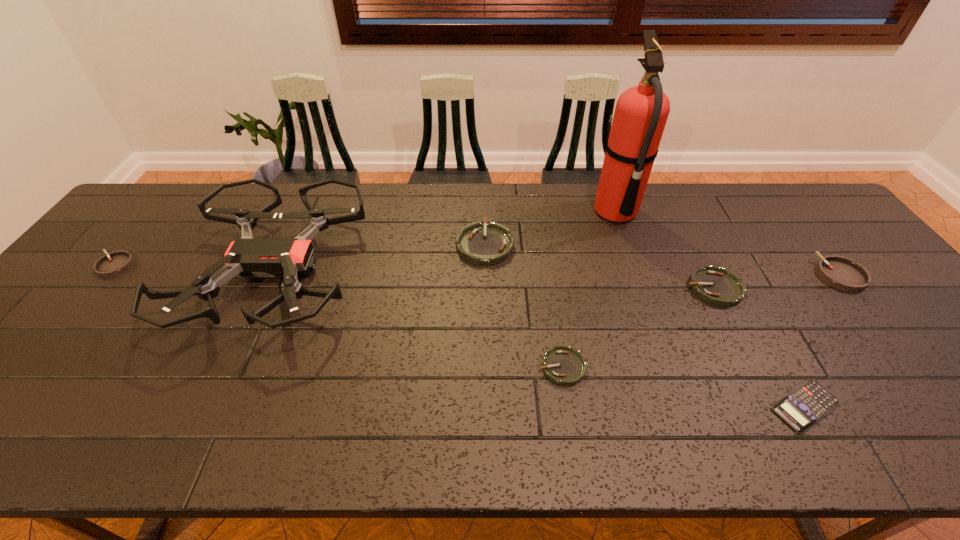
This screenshot has height=540, width=960. I want to click on the tallest object, so click(641, 113).

Locate an element on the screen. Image resolution: width=960 pixels, height=540 pixels. red fire extinguisher is located at coordinates (641, 113).

Find the location of a particular element. drone is located at coordinates (247, 257).

Where is `the seventh shortest object`? The image size is (960, 540). the seventh shortest object is located at coordinates (247, 257).

Image resolution: width=960 pixels, height=540 pixels. I want to click on the bigger gray ashtray, so click(839, 272).

Find the location of a particular element. The height and width of the screenshot is (540, 960). the rightmost ashtray is located at coordinates (839, 272).

Identify the location of the fourth ashtray from right to left. (491, 243).

Where is `the leftmost green ashtray`? The width and height of the screenshot is (960, 540). the leftmost green ashtray is located at coordinates (491, 243).

Locate an element on the screen. This screenshot has width=960, height=540. the leftmost object is located at coordinates pos(117,262).

Identify the location of the left gray ashtray. point(117,262).